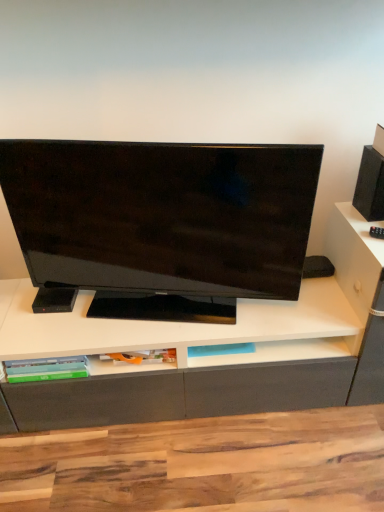
Image resolution: width=384 pixels, height=512 pixels. What do you see at coordinates (160, 224) in the screenshot?
I see `matte black tv at center` at bounding box center [160, 224].

At what (x,y) coordinates should I click in order to perform the action: click on matte black tv at center. Please return your answer as a coordinate pair (x, y). This screenshot has height=512, width=384. Looking at the image, I should click on 160,224.

This screenshot has width=384, height=512. I want to click on matte black tv at center, so click(x=160, y=224).